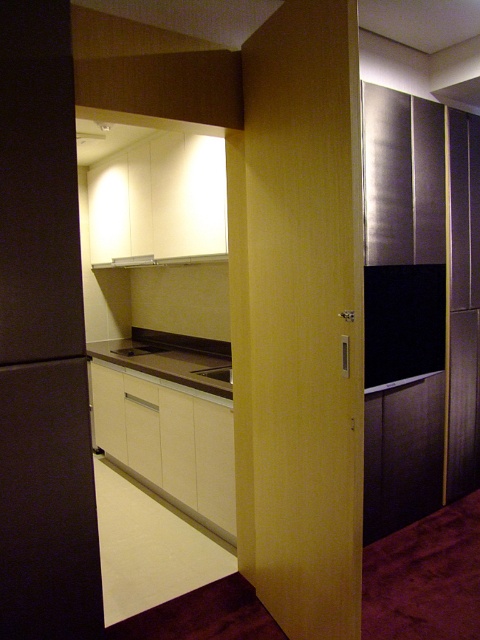
Please provide the exact coordinates of the brown laminate countertop at center in the image.

The brown laminate countertop at center is located at point (171, 358).

You are a kitchen designer planning to place a 1.2 meter wide appliance on the brown laminate countertop at center. The matte gray sink at center is already installed. Can the countertop accommodate the appliance without overlapping the sink?

The brown laminate countertop at center is bigger than the matte gray sink at center. However, the exact dimensions or spacing between them are not provided, so it is uncertain if the appliance will fit without overlapping. More information about their sizes and positions is needed to determine this.